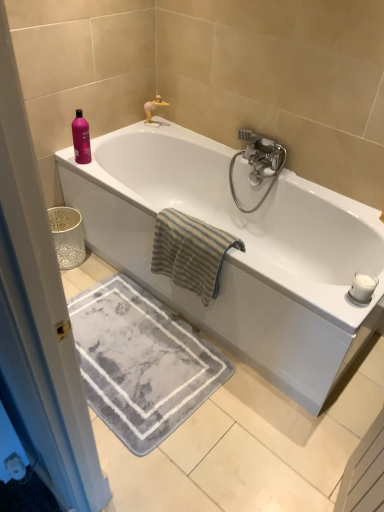
At what (x,y) coordinates should I click in order to perform the action: click on vacant space to the right of gray soft rug at lower center. Please return your answer as a coordinate pair (x, y). This screenshot has height=512, width=384. Looking at the image, I should click on (257, 416).